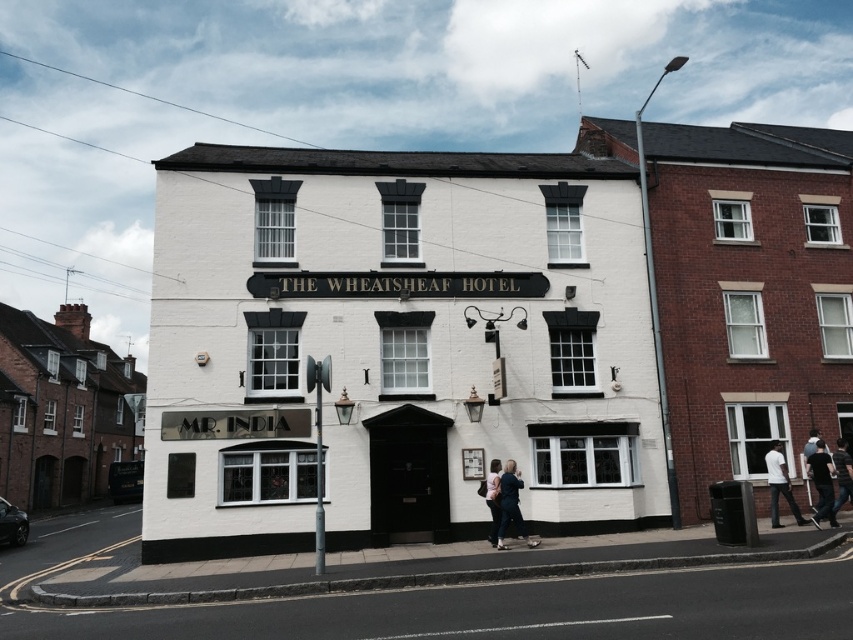
Question: Is dark blue dress at lower center further to camera compared to light brown leather jacket at lower center?

Choices:
 (A) yes
 (B) no

Answer: (B)

Question: Which point is closer to the camera?

Choices:
 (A) (503, 493)
 (B) (828, 467)
 (C) (850, 500)

Answer: (A)

Question: Can you confirm if dark blue jeans at lower right is positioned below light brown leather jacket at lower center?

Choices:
 (A) yes
 (B) no

Answer: (B)

Question: Which object is closer to the camera taking this photo?

Choices:
 (A) white cotton shirt at lower right
 (B) light brown leather jacket at lower center
 (C) black cotton shirt at lower right

Answer: (B)

Question: Can you confirm if black cotton shirt at lower right is bigger than white cotton shirt at lower right?

Choices:
 (A) no
 (B) yes

Answer: (B)

Question: Which of the following is the farthest from the observer?

Choices:
 (A) light brown leather jacket at lower center
 (B) white cotton shirt at lower right

Answer: (B)